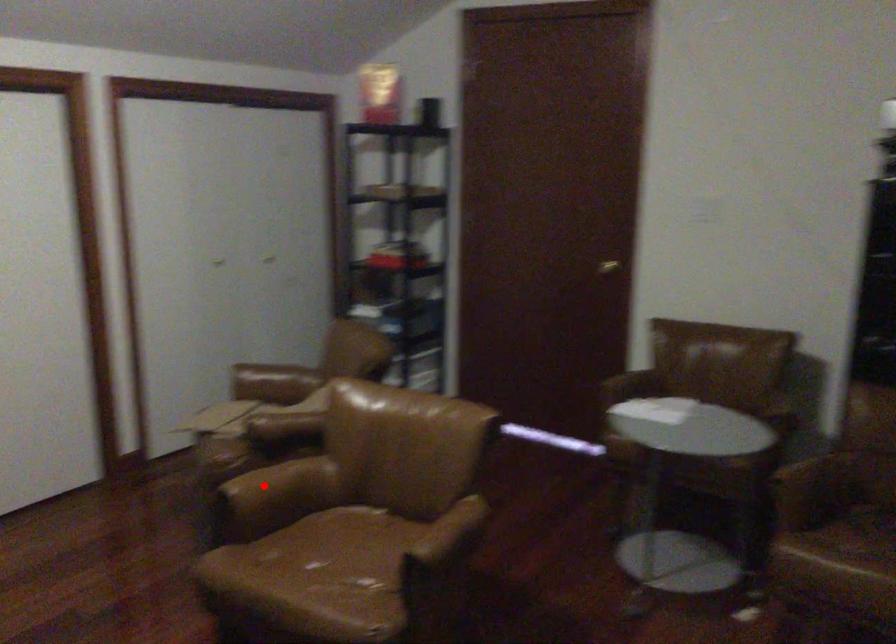
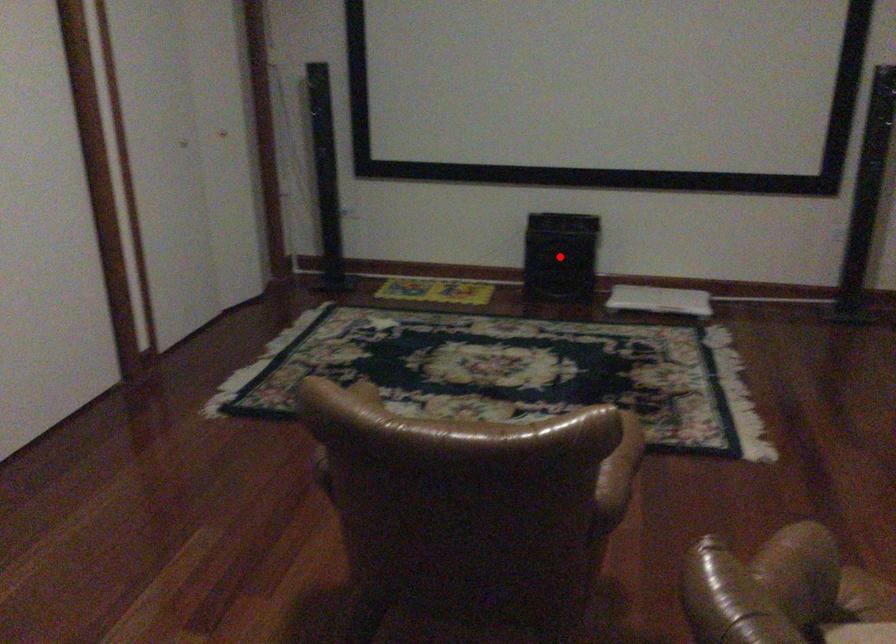
Looking at this image, I am providing you with two images of the same scene from different viewpoints. A red point is marked on the first image and another point is marked on the second image. Are the points marked in image1 and image2 representing the same 3D position?

No